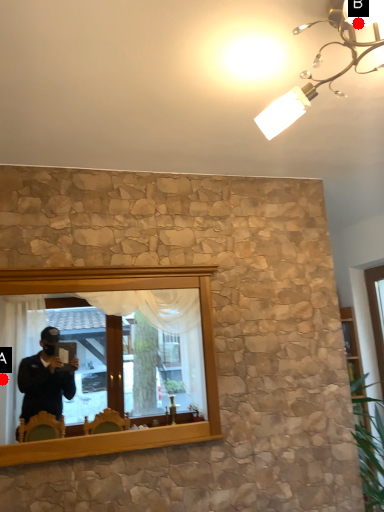
Question: Two points are circled on the image, labeled by A and B beside each circle. Which point is closer to the camera taking this photo?

Choices:
 (A) A is closer
 (B) B is closer

Answer: (B)